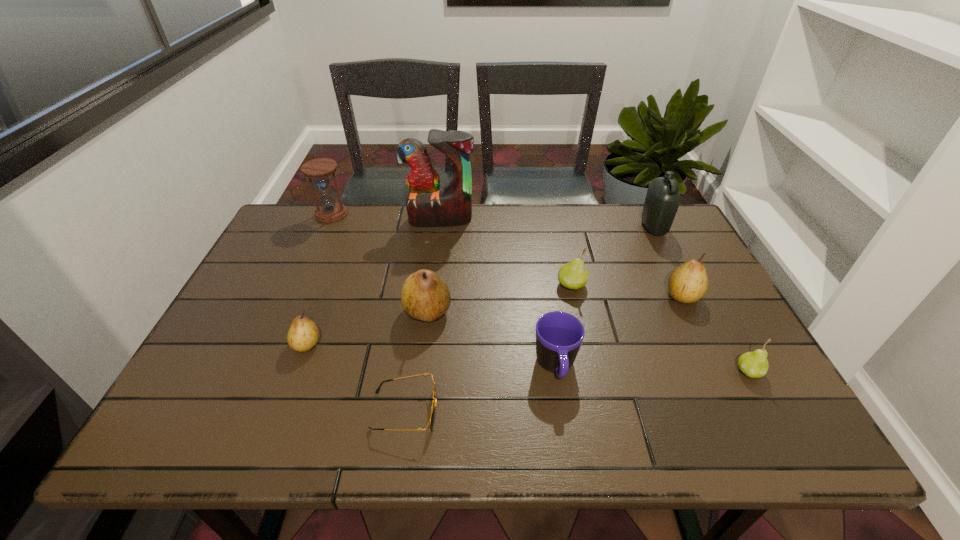
Identify the location of the fourth farthest pear. Image resolution: width=960 pixels, height=540 pixels. (303, 334).

The height and width of the screenshot is (540, 960). What are the coordinates of `the nearest pear` in the screenshot? It's located at (754, 364).

Image resolution: width=960 pixels, height=540 pixels. Find the location of `the nearer green pear`. the nearer green pear is located at coordinates (754, 364).

Find the location of a particular element. sunglasses is located at coordinates (433, 409).

The width and height of the screenshot is (960, 540). What are the coordinates of `black sunglasses` in the screenshot? It's located at (433, 409).

Image resolution: width=960 pixels, height=540 pixels. What are the coordinates of `free spot located 0.290m at the face of the tallest object` in the screenshot? It's located at (432, 292).

Find the location of a particular element. The height and width of the screenshot is (540, 960). free location located 0.190m on the front of the bottle is located at coordinates (680, 280).

Where is `vacant space situated 0.340m on the right of the hourglass`? The width and height of the screenshot is (960, 540). vacant space situated 0.340m on the right of the hourglass is located at coordinates (450, 214).

You are a GUI agent. You are given a task and a screenshot of the screen. Output one action in this format:
    pyautogui.click(x=<x>, y=<y>)
    Task: Click on the vacant area located 0.160m on the right of the fourth pear from right to left
    
    Given the screenshot: What is the action you would take?
    pyautogui.click(x=514, y=312)

At what (x,y) coordinates should I click in order to perform the action: click on free spot located 0.350m on the left of the rightmost brown pear. Please return your answer as a coordinate pair (x, y). The image size is (960, 540). Looking at the image, I should click on (534, 296).